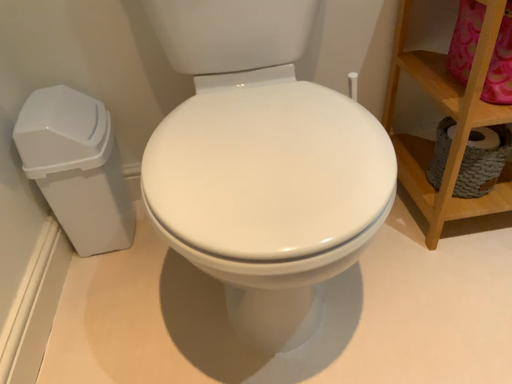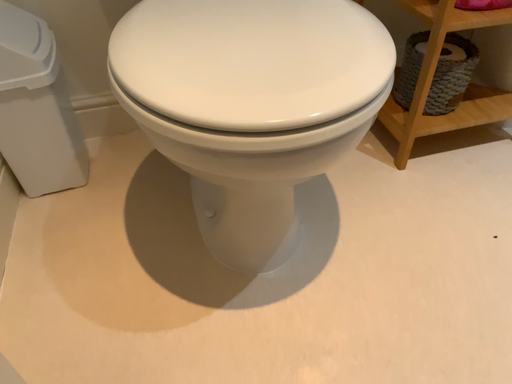
Question: How did the camera likely rotate when shooting the video?

Choices:
 (A) rotated right
 (B) rotated left

Answer: (A)